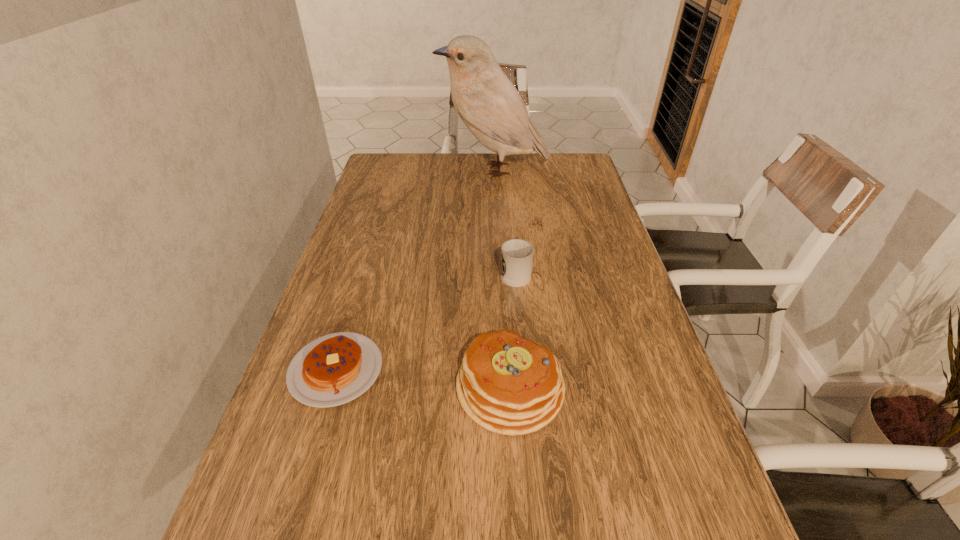
Where is `free spot that satisfies the following two spatial constraints: 1. on the front side of the shortest object; 2. on the right side of the taller pancake`? free spot that satisfies the following two spatial constraints: 1. on the front side of the shortest object; 2. on the right side of the taller pancake is located at coordinates (330, 388).

Where is `blank area in the image that satisfies the following two spatial constraints: 1. on the face of the taller pancake; 2. on the left side of the parakeet`? This screenshot has width=960, height=540. blank area in the image that satisfies the following two spatial constraints: 1. on the face of the taller pancake; 2. on the left side of the parakeet is located at coordinates (506, 388).

Where is `free space that satisfies the following two spatial constraints: 1. on the face of the parakeet; 2. on the back side of the right pancake`? This screenshot has height=540, width=960. free space that satisfies the following two spatial constraints: 1. on the face of the parakeet; 2. on the back side of the right pancake is located at coordinates (506, 388).